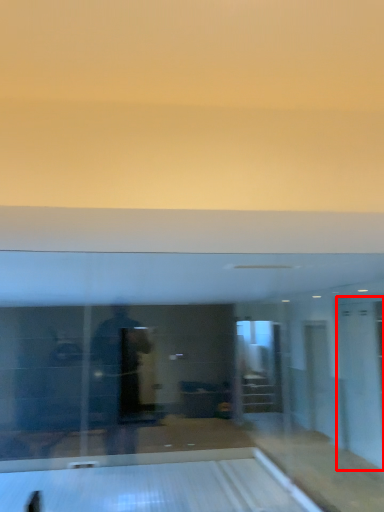
Question: From the image, what is the correct spatial relationship of glass door (annotated by the red box) in relation to bowling alley?

Choices:
 (A) left
 (B) right

Answer: (B)